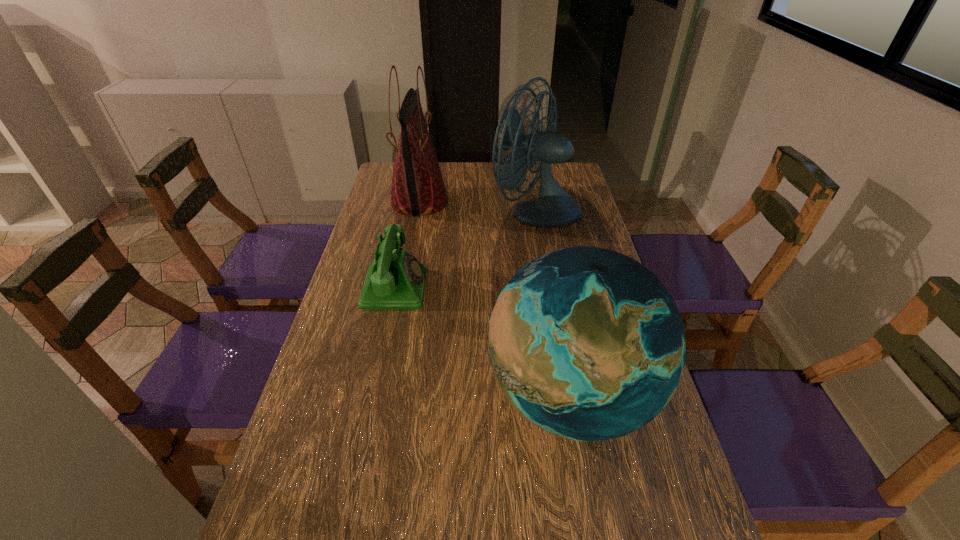
At what (x,y) coordinates should I click in order to perform the action: click on vacant space at the far edge of the desktop. Please return your answer as a coordinate pair (x, y). The image size is (960, 540). Looking at the image, I should click on (479, 183).

Image resolution: width=960 pixels, height=540 pixels. In order to click on vacant space at the left edge in this screenshot , I will do `click(337, 404)`.

Where is `vacant point located between the third farthest object and the globe`? The image size is (960, 540). vacant point located between the third farthest object and the globe is located at coordinates (483, 342).

This screenshot has height=540, width=960. I want to click on empty location between the telephone and the nearest object, so tap(483, 342).

Image resolution: width=960 pixels, height=540 pixels. I want to click on vacant region between the handbag and the shortest object, so click(x=407, y=245).

This screenshot has height=540, width=960. Identify the location of blank region between the handbag and the shortest object. (407, 245).

The width and height of the screenshot is (960, 540). I want to click on vacant region between the handbag and the fan, so click(x=477, y=206).

At what (x,y) coordinates should I click in order to perform the action: click on vacant space that's between the globe and the handbag. Please return your answer as a coordinate pair (x, y). The width and height of the screenshot is (960, 540). Looking at the image, I should click on 494,299.

Where is `free spot between the handbag and the fan`? The width and height of the screenshot is (960, 540). free spot between the handbag and the fan is located at coordinates (477, 206).

The image size is (960, 540). What are the coordinates of `free spot between the second shortest object and the second nearest object` in the screenshot? It's located at (483, 342).